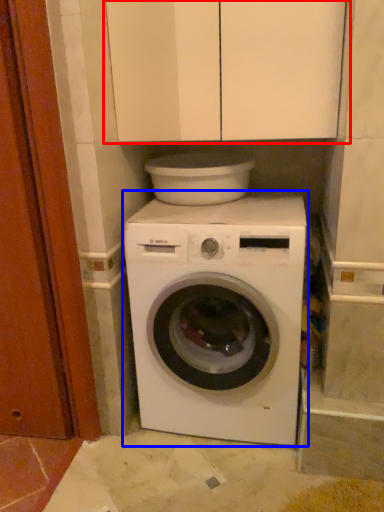
Question: Which of the following is the closest to the observer, cabinetry (highlighted by a red box) or washing machine (highlighted by a blue box)?

Choices:
 (A) cabinetry
 (B) washing machine

Answer: (A)